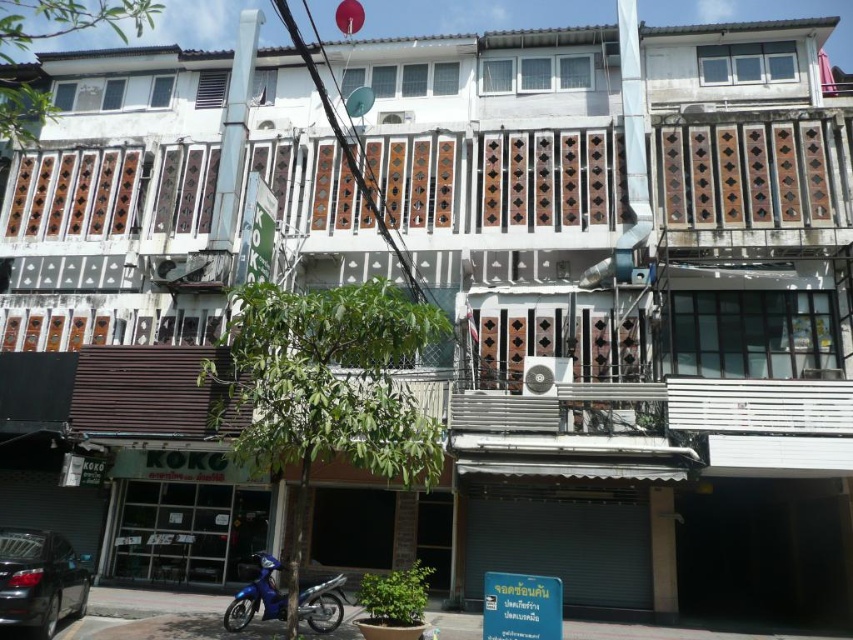
Looking at this image, you are a delivery person who needs to park your vehicle in a spot that can accommodate your vehicle size. You see a shiny black car at lower left and a blue matte motorcycle at lower left. Which parking spot can fit your vehicle if you have a car?

The shiny black car at lower left is larger in size than blue matte motorcycle at lower left, so the parking spot where the shiny black car at lower left is parked can fit your car.

You are a delivery person needing to park your vehicle in a tight space next to the shiny black car at lower left and the blue matte motorcycle at lower left. Which vehicle should you avoid to ensure enough space?

You should avoid the shiny black car at lower left because its width is less than the blue matte motorcycle at lower left, meaning the motorcycle takes up more space and would require more room.

You are a delivery person needing to park your 6.5 feet long delivery van between the shiny black car at lower left and the blue matte motorcycle at lower left. Can you fit your van there?

The distance between the shiny black car at lower left and the blue matte motorcycle at lower left is 8.02 feet. Since your van is 6.5 feet long, it can fit in the space as there is enough room between them.